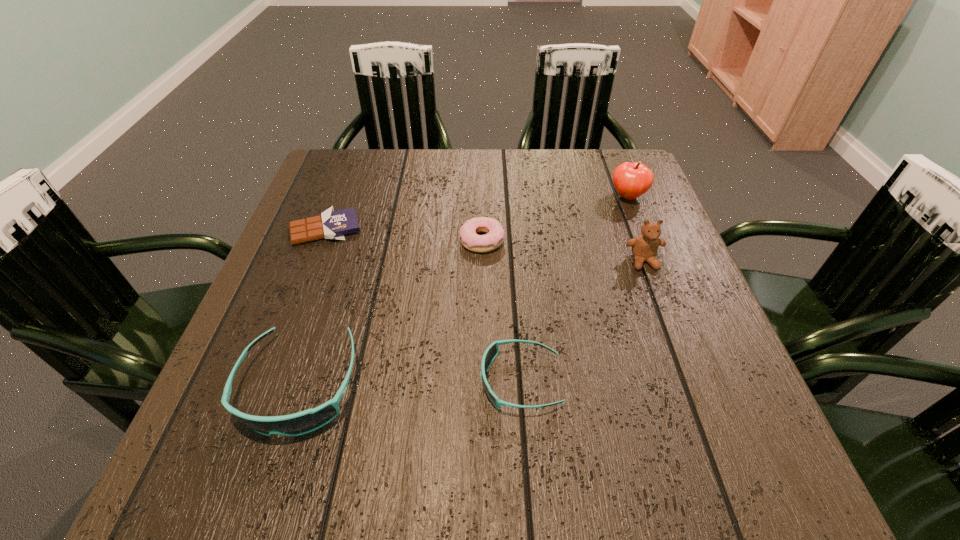
Please point a spot to add another sunglasses on the right. Please provide its 2D coordinates. Your answer should be formatted as a tuple, i.e. [(x, y)], where the tuple contains the x and y coordinates of a point satisfying the conditions above.

[(739, 378)]